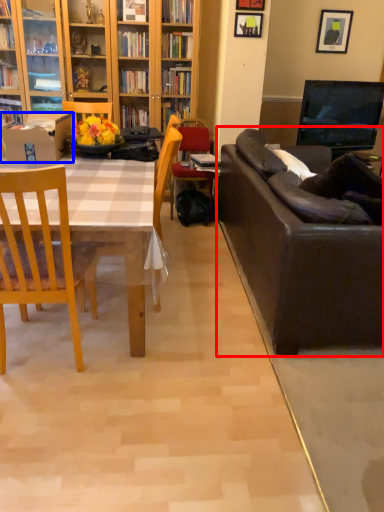
Question: Among these objects, which one is nearest to the camera, studio couch (highlighted by a red box) or box (highlighted by a blue box)?

Choices:
 (A) studio couch
 (B) box

Answer: (A)